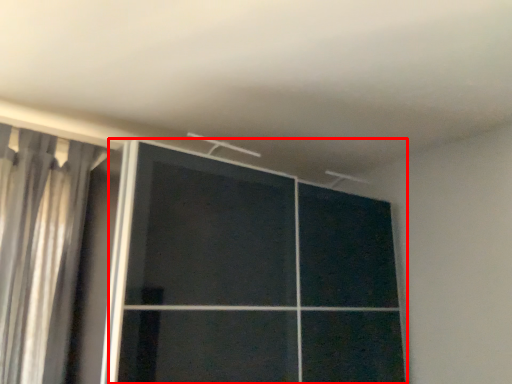
Question: Considering the relative positions of door (annotated by the red box) and curtain in the image provided, where is door (annotated by the red box) located with respect to the staircase?

Choices:
 (A) right
 (B) left

Answer: (A)